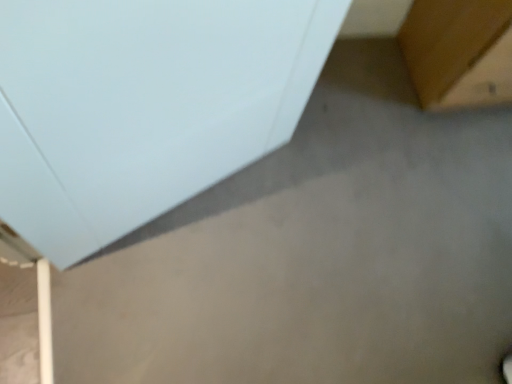
Describe the element at coordinates (143, 105) in the screenshot. I see `white matte cabinet at upper left, which is counted as the first furniture, starting from the left` at that location.

This screenshot has width=512, height=384. I want to click on white matte cabinet at upper left, which is counted as the first furniture, starting from the left, so click(x=143, y=105).

This screenshot has width=512, height=384. In order to click on brown wood table at upper right, placed as the 2th furniture when sorted from left to right in this screenshot , I will do 459,51.

This screenshot has width=512, height=384. What do you see at coordinates (459, 51) in the screenshot?
I see `brown wood table at upper right, placed as the 2th furniture when sorted from left to right` at bounding box center [459, 51].

Find the location of `white matte cabinet at upper left, which is counted as the first furniture, starting from the left`. white matte cabinet at upper left, which is counted as the first furniture, starting from the left is located at coordinates (143, 105).

Would you say brown wood table at upper right, which appears as the first furniture when viewed from the right, is to the left or to the right of white matte cabinet at upper left, which appears as the second furniture when viewed from the right, in the picture?

brown wood table at upper right, which appears as the first furniture when viewed from the right, is to the right of white matte cabinet at upper left, which appears as the second furniture when viewed from the right.

Which object is further away from the camera taking this photo, brown wood table at upper right, placed as the 2th furniture when sorted from left to right, or white matte cabinet at upper left, which is counted as the first furniture, starting from the left?

brown wood table at upper right, placed as the 2th furniture when sorted from left to right, is further away from the camera.

Between point (505, 79) and point (164, 206), which one is positioned behind?

Point (505, 79)

From the image's perspective, is brown wood table at upper right, placed as the 2th furniture when sorted from left to right, located above or below white matte cabinet at upper left, which appears as the second furniture when viewed from the right?

Based on their image positions, brown wood table at upper right, placed as the 2th furniture when sorted from left to right, is located above white matte cabinet at upper left, which appears as the second furniture when viewed from the right.

From a real-world perspective, who is located higher, brown wood table at upper right, placed as the 2th furniture when sorted from left to right, or white matte cabinet at upper left, which is counted as the first furniture, starting from the left?

white matte cabinet at upper left, which is counted as the first furniture, starting from the left, is physically above.

Does brown wood table at upper right, which appears as the first furniture when viewed from the right, have a lesser width compared to white matte cabinet at upper left, which appears as the second furniture when viewed from the right?

No, brown wood table at upper right, which appears as the first furniture when viewed from the right, is not thinner than white matte cabinet at upper left, which appears as the second furniture when viewed from the right.

Who is shorter, brown wood table at upper right, placed as the 2th furniture when sorted from left to right, or white matte cabinet at upper left, which appears as the second furniture when viewed from the right?

brown wood table at upper right, placed as the 2th furniture when sorted from left to right.

Considering the sizes of brown wood table at upper right, placed as the 2th furniture when sorted from left to right, and white matte cabinet at upper left, which appears as the second furniture when viewed from the right, in the image, is brown wood table at upper right, placed as the 2th furniture when sorted from left to right, bigger or smaller than white matte cabinet at upper left, which appears as the second furniture when viewed from the right,?

Considering their sizes, brown wood table at upper right, placed as the 2th furniture when sorted from left to right, takes up more space than white matte cabinet at upper left, which appears as the second furniture when viewed from the right.

Is brown wood table at upper right, which appears as the first furniture when viewed from the right, spatially inside white matte cabinet at upper left, which is counted as the first furniture, starting from the left, or outside of it?

brown wood table at upper right, which appears as the first furniture when viewed from the right, is not enclosed by white matte cabinet at upper left, which is counted as the first furniture, starting from the left.

Is brown wood table at upper right, which appears as the first furniture when viewed from the right, directly adjacent to white matte cabinet at upper left, which is counted as the first furniture, starting from the left?

No, brown wood table at upper right, which appears as the first furniture when viewed from the right, is not in contact with white matte cabinet at upper left, which is counted as the first furniture, starting from the left.

Is brown wood table at upper right, placed as the 2th furniture when sorted from left to right, facing away from white matte cabinet at upper left, which appears as the second furniture when viewed from the right?

No, brown wood table at upper right, placed as the 2th furniture when sorted from left to right,'s orientation is not away from white matte cabinet at upper left, which appears as the second furniture when viewed from the right.

Can you tell me how much brown wood table at upper right, placed as the 2th furniture when sorted from left to right, and white matte cabinet at upper left, which is counted as the first furniture, starting from the left, differ in facing direction?

They differ by 25.2 degrees in their facing directions.

In the image, there is a brown wood table at upper right, which appears as the first furniture when viewed from the right. Where is `furniture below it (from the image's perspective)`? The image size is (512, 384). furniture below it (from the image's perspective) is located at coordinates [143, 105].

Does white matte cabinet at upper left, which appears as the second furniture when viewed from the right, appear on the left side of brown wood table at upper right, which appears as the first furniture when viewed from the right?

Indeed, white matte cabinet at upper left, which appears as the second furniture when viewed from the right, is positioned on the left side of brown wood table at upper right, which appears as the first furniture when viewed from the right.

Is white matte cabinet at upper left, which is counted as the first furniture, starting from the left, in front of or behind brown wood table at upper right, which appears as the first furniture when viewed from the right, in the image?

white matte cabinet at upper left, which is counted as the first furniture, starting from the left, is in front of brown wood table at upper right, which appears as the first furniture when viewed from the right.

Considering the points (80, 101) and (481, 30), which point is in front, point (80, 101) or point (481, 30)?

The point (80, 101) is in front.

From the image's perspective, between white matte cabinet at upper left, which is counted as the first furniture, starting from the left, and brown wood table at upper right, which appears as the first furniture when viewed from the right, who is located below?

white matte cabinet at upper left, which is counted as the first furniture, starting from the left.

From a real-world perspective, which object rests below the other?

From a 3D spatial view, brown wood table at upper right, which appears as the first furniture when viewed from the right, is below.

Is white matte cabinet at upper left, which is counted as the first furniture, starting from the left, thinner than brown wood table at upper right, placed as the 2th furniture when sorted from left to right?

Yes, white matte cabinet at upper left, which is counted as the first furniture, starting from the left, is thinner than brown wood table at upper right, placed as the 2th furniture when sorted from left to right.

In terms of height, does white matte cabinet at upper left, which is counted as the first furniture, starting from the left, look taller or shorter compared to brown wood table at upper right, placed as the 2th furniture when sorted from left to right?

In the image, white matte cabinet at upper left, which is counted as the first furniture, starting from the left, appears to be taller than brown wood table at upper right, placed as the 2th furniture when sorted from left to right.

Considering the relative sizes of white matte cabinet at upper left, which is counted as the first furniture, starting from the left, and brown wood table at upper right, which appears as the first furniture when viewed from the right, in the image provided, is white matte cabinet at upper left, which is counted as the first furniture, starting from the left, smaller than brown wood table at upper right, which appears as the first furniture when viewed from the right,?

Correct, white matte cabinet at upper left, which is counted as the first furniture, starting from the left, occupies less space than brown wood table at upper right, which appears as the first furniture when viewed from the right.

Is brown wood table at upper right, placed as the 2th furniture when sorted from left to right, located within white matte cabinet at upper left, which appears as the second furniture when viewed from the right?

No, brown wood table at upper right, placed as the 2th furniture when sorted from left to right, is located outside of white matte cabinet at upper left, which appears as the second furniture when viewed from the right.

Is white matte cabinet at upper left, which is counted as the first furniture, starting from the left, positioned far away from brown wood table at upper right, which appears as the first furniture when viewed from the right?

That's not correct — white matte cabinet at upper left, which is counted as the first furniture, starting from the left, is a little close to brown wood table at upper right, which appears as the first furniture when viewed from the right.

Is white matte cabinet at upper left, which is counted as the first furniture, starting from the left, looking in the opposite direction of brown wood table at upper right, placed as the 2th furniture when sorted from left to right?

No, brown wood table at upper right, placed as the 2th furniture when sorted from left to right, is not at the back of white matte cabinet at upper left, which is counted as the first furniture, starting from the left.

How many degrees apart are the facing directions of white matte cabinet at upper left, which is counted as the first furniture, starting from the left, and brown wood table at upper right, which appears as the first furniture when viewed from the right?

25.2 degrees separate the facing orientations of white matte cabinet at upper left, which is counted as the first furniture, starting from the left, and brown wood table at upper right, which appears as the first furniture when viewed from the right.

Measure the distance from white matte cabinet at upper left, which is counted as the first furniture, starting from the left, to brown wood table at upper right, placed as the 2th furniture when sorted from left to right.

They are 33.09 inches apart.

Locate an element on the screen. The width and height of the screenshot is (512, 384). furniture behind the white matte cabinet at upper left, which appears as the second furniture when viewed from the right is located at coordinates (459, 51).

This screenshot has height=384, width=512. Identify the location of furniture above the white matte cabinet at upper left, which is counted as the first furniture, starting from the left (from the image's perspective). (459, 51).

Locate an element on the screen. The width and height of the screenshot is (512, 384). furniture that is in front of the brown wood table at upper right, which appears as the first furniture when viewed from the right is located at coordinates (143, 105).